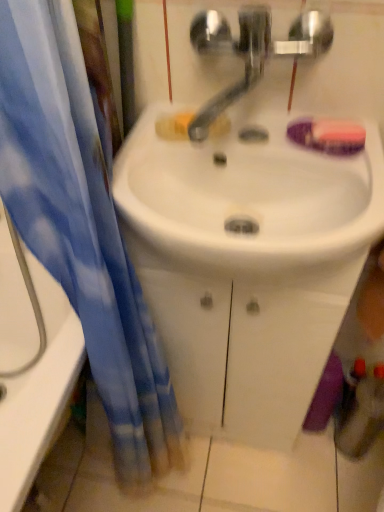
You are a GUI agent. You are given a task and a screenshot of the screen. Output one action in this format:
    pyautogui.click(x=<x>, y=<y>)
    Task: Click on the white glossy bathtub at left
    The image size is (384, 512).
    Given the screenshot: What is the action you would take?
    pyautogui.click(x=31, y=368)

This screenshot has width=384, height=512. What do you see at coordinates (31, 368) in the screenshot? I see `white glossy bathtub at left` at bounding box center [31, 368].

Locate an element on the screen. satin nickel faucet at center is located at coordinates (252, 51).

The image size is (384, 512). What are the coordinates of `blue fabric curtain at left` in the screenshot? It's located at (82, 221).

Find the location of a particular element. purple matte soap at upper right is located at coordinates (328, 135).

Image resolution: width=384 pixels, height=512 pixels. What do you see at coordinates (253, 155) in the screenshot?
I see `white glossy sink at center` at bounding box center [253, 155].

Find the location of a particular element. Image resolution: width=384 pixels, height=512 pixels. white glossy bathtub at left is located at coordinates (31, 368).

Is satin nickel faucet at center oriented towards white glossy bathtub at left?

No, satin nickel faucet at center is not oriented towards white glossy bathtub at left.

Does point (199, 48) appear closer or farther from the camera than point (23, 398)?

Clearly, point (199, 48) is closer to the camera than point (23, 398).

From the image's perspective, is satin nickel faucet at center located above or below white glossy bathtub at left?

satin nickel faucet at center is above white glossy bathtub at left.

How different are the orientations of satin nickel faucet at center and white glossy sink at center in degrees?

The angle between the facing direction of satin nickel faucet at center and the facing direction of white glossy sink at center is 1.85 degrees.

In the image, there is a satin nickel faucet at center. Identify the location of sink below it (from a real-world perspective). The image size is (384, 512). (253, 155).

From the picture: From the image's perspective, is satin nickel faucet at center beneath white glossy sink at center?

Incorrect, from the image's perspective, satin nickel faucet at center is higher than white glossy sink at center.

Is the position of satin nickel faucet at center less distant than that of white glossy sink at center?

That is True.

From the image's perspective, is blue fabric curtain at left on satin nickel faucet at center?

No, from the image's perspective, blue fabric curtain at left is not over satin nickel faucet at center.

Locate an element on the screen. The width and height of the screenshot is (384, 512). tap that appears on the right of blue fabric curtain at left is located at coordinates 252,51.

In the scene shown: Is blue fabric curtain at left positioned with its back to satin nickel faucet at center?

blue fabric curtain at left is not turned away from satin nickel faucet at center.

Is purple matte soap at upper right directly adjacent to white glossy bathtub at left?

They are not placed beside each other.

Is point (340, 128) less distant than point (49, 342)?

Yes.

Is purple matte soap at upper right oriented away from white glossy bathtub at left?

purple matte soap at upper right is not turned away from white glossy bathtub at left.

Measure the distance from purple matte soap at upper right to white glossy bathtub at left.

They are 27.09 inches apart.

Who is shorter, purple matte soap at upper right or satin nickel faucet at center?

purple matte soap at upper right.

At what (x,y) coordinates should I click in order to perform the action: click on tap above the purple matte soap at upper right (from the image's perspective). Please return your answer as a coordinate pair (x, y). This screenshot has width=384, height=512. Looking at the image, I should click on (252, 51).

From a real-world perspective, who is located lower, purple matte soap at upper right or satin nickel faucet at center?

purple matte soap at upper right is physically lower.

From the image's perspective, is purple matte soap at upper right over satin nickel faucet at center?

Incorrect, from the image's perspective, purple matte soap at upper right is lower than satin nickel faucet at center.

Looking at this image, is white glossy sink at center smaller than satin nickel faucet at center?

No.

At what (x,y) coordinates should I click in order to perform the action: click on sink behind the satin nickel faucet at center. Please return your answer as a coordinate pair (x, y). Looking at the image, I should click on (253, 155).

Is white glossy sink at center outside of satin nickel faucet at center?

white glossy sink at center is positioned outside satin nickel faucet at center.

From a real-world perspective, is white glossy sink at center positioned under satin nickel faucet at center based on gravity?

Yes, from a real-world perspective, white glossy sink at center is below satin nickel faucet at center.

Who is shorter, blue fabric curtain at left or white glossy sink at center?

white glossy sink at center is shorter.

From the image's perspective, is blue fabric curtain at left above or below white glossy sink at center?

blue fabric curtain at left is situated lower than white glossy sink at center in the image.

Is blue fabric curtain at left bigger or smaller than white glossy sink at center?

blue fabric curtain at left is bigger than white glossy sink at center.

Who is more distant, blue fabric curtain at left or white glossy sink at center?

white glossy sink at center is further from the camera.

I want to click on tap in front of the white glossy bathtub at left, so click(252, 51).

In the image, there is a satin nickel faucet at center. What are the coordinates of `sink below it (from a real-world perspective)` in the screenshot? It's located at (253, 155).

Which object lies nearer to the anchor point white glossy bathtub at left, satin nickel faucet at center or purple matte soap at upper right?

Among the two, satin nickel faucet at center is located nearer to white glossy bathtub at left.

Considering their positions, is white glossy bathtub at left positioned further to blue fabric curtain at left than white glossy sink at center?

white glossy bathtub at left is further to blue fabric curtain at left.

Estimate the real-world distances between objects in this image. Which object is closer to blue fabric curtain at left, satin nickel faucet at center or white glossy bathtub at left?

The object closer to blue fabric curtain at left is white glossy bathtub at left.

Based on their spatial positions, is purple matte soap at upper right or white glossy sink at center further from blue fabric curtain at left?

purple matte soap at upper right.

Based on their spatial positions, is purple matte soap at upper right or satin nickel faucet at center further from white glossy sink at center?

Among the two, purple matte soap at upper right is located further to white glossy sink at center.

Based on the photo, considering their positions, is white glossy sink at center positioned further to satin nickel faucet at center than purple matte soap at upper right?

purple matte soap at upper right.

Estimate the real-world distances between objects in this image. Which object is closer to satin nickel faucet at center, white glossy bathtub at left or purple matte soap at upper right?

Based on the image, purple matte soap at upper right appears to be nearer to satin nickel faucet at center.

Which object lies nearer to the anchor point blue fabric curtain at left, purple matte soap at upper right or satin nickel faucet at center?

satin nickel faucet at center is closer to blue fabric curtain at left.

This screenshot has width=384, height=512. Identify the location of tap between white glossy bathtub at left and purple matte soap at upper right from left to right. (252, 51).

This screenshot has width=384, height=512. In order to click on curtain between white glossy bathtub at left and purple matte soap at upper right in the horizontal direction in this screenshot , I will do `click(82, 221)`.

You are a GUI agent. You are given a task and a screenshot of the screen. Output one action in this format:
    pyautogui.click(x=<x>, y=<y>)
    Task: Click on the curtain between white glossy bathtub at left and white glossy sink at center in the horizontal direction
    This screenshot has width=384, height=512.
    Given the screenshot: What is the action you would take?
    pyautogui.click(x=82, y=221)

You are a GUI agent. You are given a task and a screenshot of the screen. Output one action in this format:
    pyautogui.click(x=<x>, y=<y>)
    Task: Click on the sink between blue fabric curtain at left and purple matte soap at upper right in the horizontal direction
    
    Given the screenshot: What is the action you would take?
    coord(253,155)